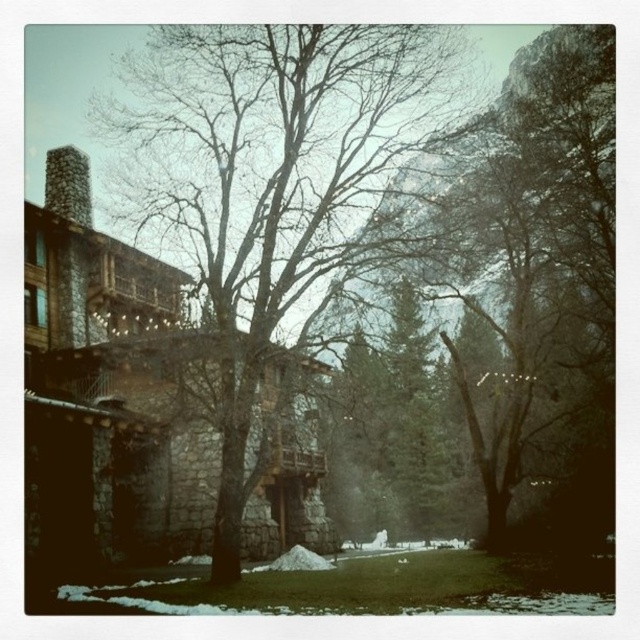
Which is more to the right, bare wood tree at center or stone chimney at left?

Positioned to the right is bare wood tree at center.

Does bare wood tree at center have a larger size compared to stone chimney at left?

Indeed, bare wood tree at center has a larger size compared to stone chimney at left.

Is point (125, 112) in front of point (58, 166)?

That is False.

This screenshot has width=640, height=640. What are the coordinates of `bare wood tree at center` in the screenshot? It's located at (275, 182).